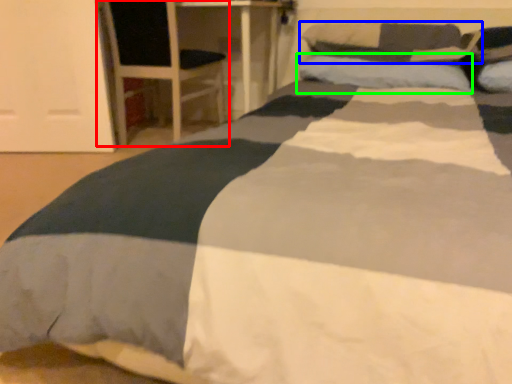
Question: Which object is positioned farthest from armchair (highlighted by a red box)? Select from pillow (highlighted by a blue box) and pillow (highlighted by a green box).

Choices:
 (A) pillow
 (B) pillow

Answer: (A)